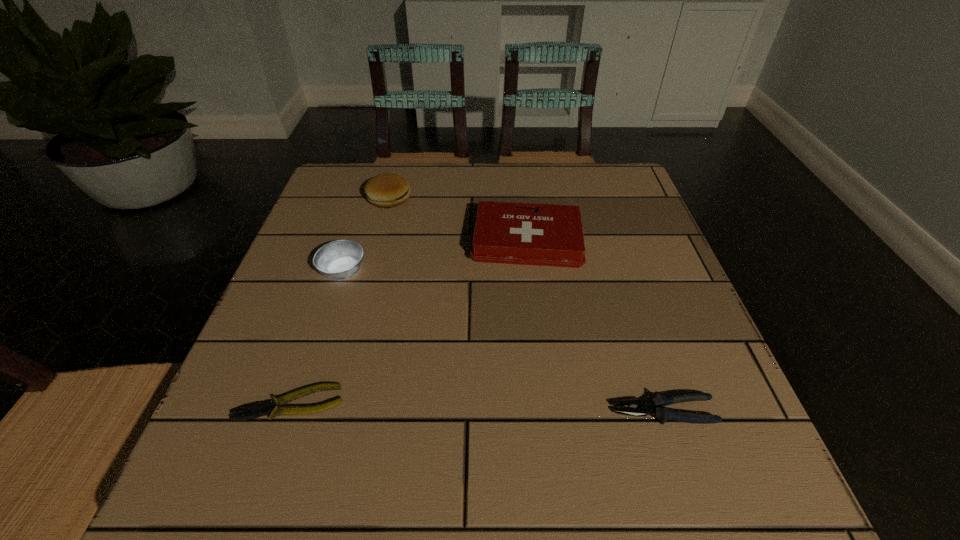
Image resolution: width=960 pixels, height=540 pixels. What are the coordinates of `vacant area that satisfies the following two spatial constraints: 1. on the back side of the ashtray; 2. on the right side of the tallest object` in the screenshot? It's located at (367, 198).

Where is `free space that satisfies the following two spatial constraints: 1. on the front side of the first-aid kit; 2. on the left side of the farthest object`? The width and height of the screenshot is (960, 540). free space that satisfies the following two spatial constraints: 1. on the front side of the first-aid kit; 2. on the left side of the farthest object is located at coordinates (378, 241).